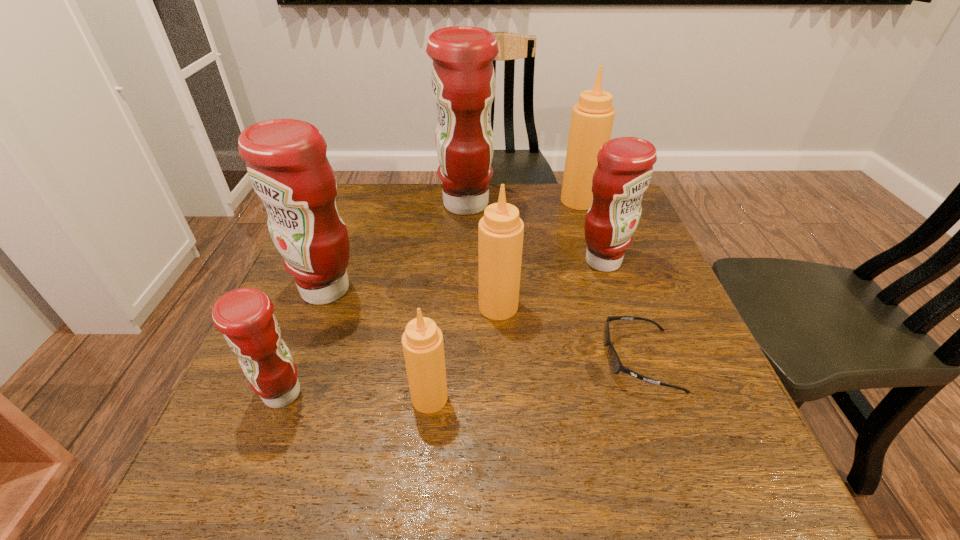
Where is `vacant space located on the front-facing side of the gray sunglasses`? The image size is (960, 540). vacant space located on the front-facing side of the gray sunglasses is located at coordinates (423, 360).

The height and width of the screenshot is (540, 960). I want to click on vacant position located 0.370m on the front-facing side of the gray sunglasses, so click(413, 360).

In order to click on vacant area situated 0.050m on the front-facing side of the gray sunglasses in this screenshot , I will do `click(578, 360)`.

Where is `sunglasses that is positioned at the right edge`? The height and width of the screenshot is (540, 960). sunglasses that is positioned at the right edge is located at coordinates (615, 363).

Locate an element on the screen. Image resolution: width=960 pixels, height=540 pixels. object located at the far right corner is located at coordinates (592, 118).

Where is `vacant space at the far edge of the desktop`? vacant space at the far edge of the desktop is located at coordinates (407, 195).

In the image, there is a desktop. Identify the location of vacant space at the near edge. The image size is (960, 540). (359, 464).

Where is `vacant area at the right edge of the desktop`? vacant area at the right edge of the desktop is located at coordinates (653, 293).

This screenshot has height=540, width=960. I want to click on vacant space that's between the third smallest red condiment and the nearest tan condiment, so click(x=377, y=344).

This screenshot has height=540, width=960. Identify the location of empty space that is in between the smallest tan condiment and the shortest object. (535, 379).